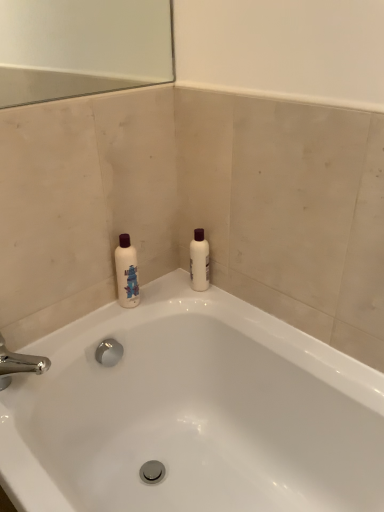
Question: Considering the relative positions of white glossy bathtub at upper center and white matte bottle at upper right in the image provided, is white glossy bathtub at upper center to the right of white matte bottle at upper right from the viewer's perspective?

Choices:
 (A) no
 (B) yes

Answer: (A)

Question: Is white glossy bathtub at upper center outside of white matte bottle at upper right?

Choices:
 (A) yes
 (B) no

Answer: (A)

Question: Does white glossy bathtub at upper center turn towards white matte bottle at upper right?

Choices:
 (A) yes
 (B) no

Answer: (B)

Question: Does white glossy bathtub at upper center lie behind white matte bottle at upper right?

Choices:
 (A) yes
 (B) no

Answer: (B)

Question: Is white glossy bathtub at upper center directly adjacent to white matte bottle at upper right?

Choices:
 (A) yes
 (B) no

Answer: (B)

Question: Does white glossy bathtub at upper center have a greater height compared to white matte bottle at upper right?

Choices:
 (A) yes
 (B) no

Answer: (A)

Question: From the image's perspective, is white matte bottle at upper right located above white glossy bathtub at upper center?

Choices:
 (A) yes
 (B) no

Answer: (A)

Question: Could you tell me if white matte bottle at upper right is turned towards white glossy bathtub at upper center?

Choices:
 (A) no
 (B) yes

Answer: (A)

Question: Considering the relative positions of white matte bottle at upper right and white glossy bathtub at upper center in the image provided, is white matte bottle at upper right to the right of white glossy bathtub at upper center from the viewer's perspective?

Choices:
 (A) yes
 (B) no

Answer: (A)

Question: Considering the relative sizes of white matte bottle at upper right and white glossy bathtub at upper center in the image provided, is white matte bottle at upper right wider than white glossy bathtub at upper center?

Choices:
 (A) yes
 (B) no

Answer: (B)

Question: Considering the relative sizes of white matte bottle at upper right and white glossy bathtub at upper center in the image provided, is white matte bottle at upper right taller than white glossy bathtub at upper center?

Choices:
 (A) yes
 (B) no

Answer: (B)

Question: Is white matte bottle at upper right outside white glossy bathtub at upper center?

Choices:
 (A) yes
 (B) no

Answer: (A)

Question: In terms of width, does white glossy bathtub at upper center look wider or thinner when compared to white matte bottle at upper right?

Choices:
 (A) thin
 (B) wide

Answer: (B)